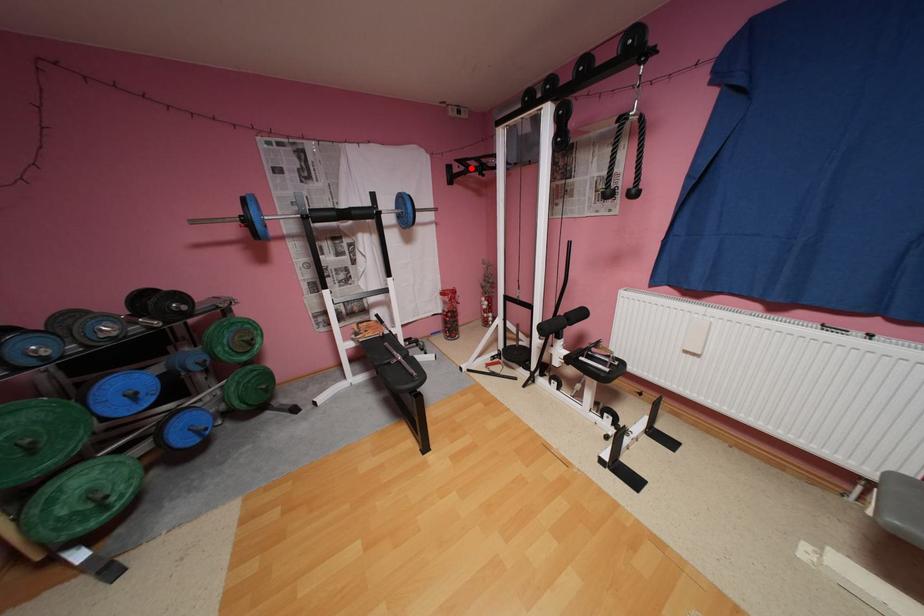
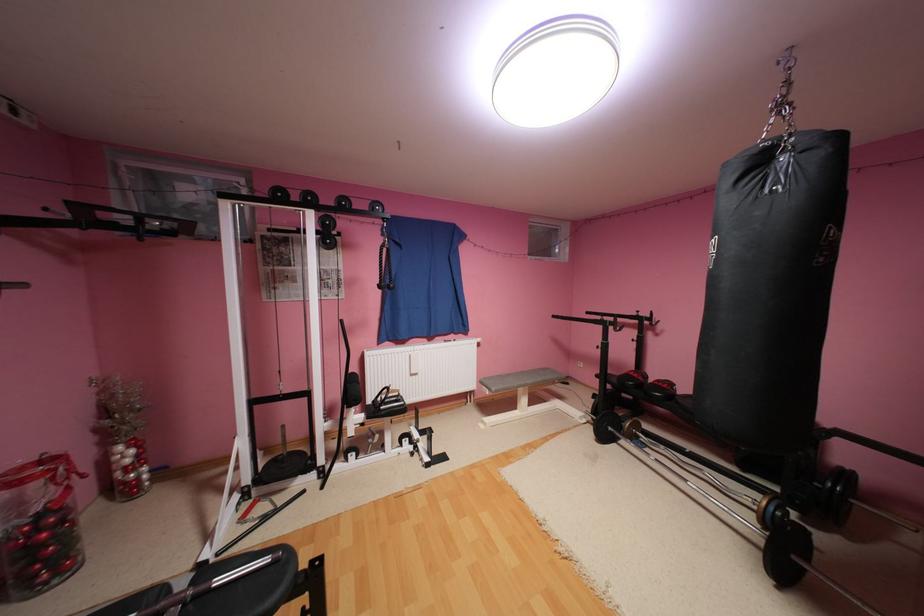
Question: I am providing you with two images of the same scene from different viewpoints. Given a red point in image1, look at the same physical point in image2. Is it:

Choices:
 (A) Closer to the viewpoint
 (B) Farther from the viewpoint

Answer: (B)